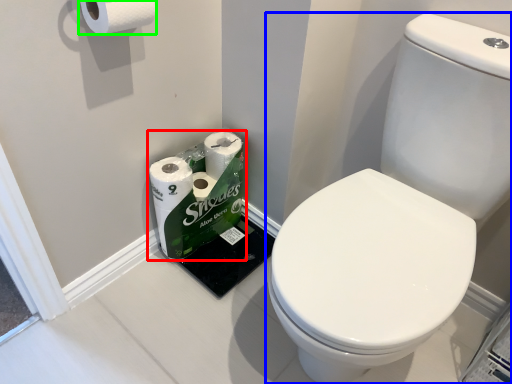
Question: Considering the real-world distances, which object is closest to toilet paper (highlighted by a red box)? toilet (highlighted by a blue box) or toilet paper (highlighted by a green box).

Choices:
 (A) toilet
 (B) toilet paper

Answer: (A)